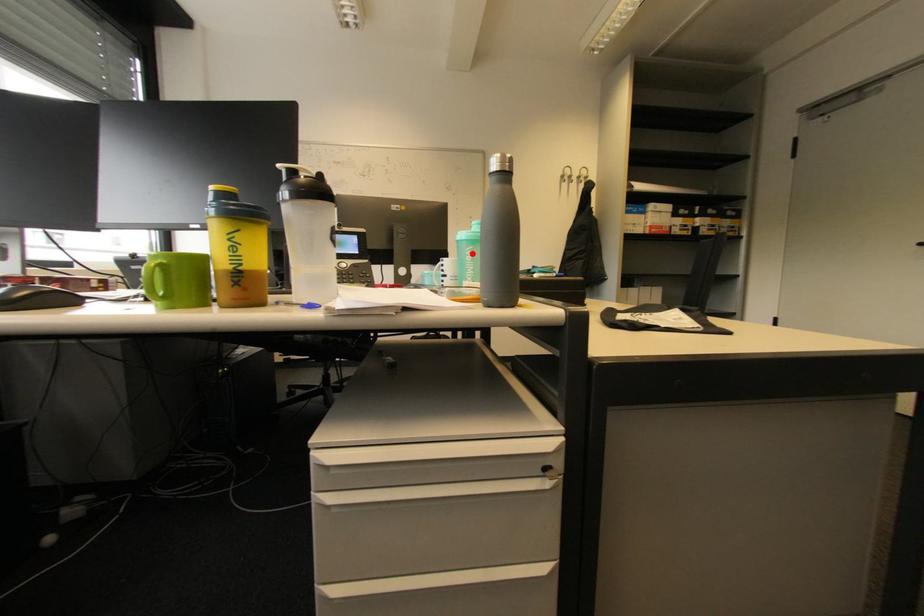
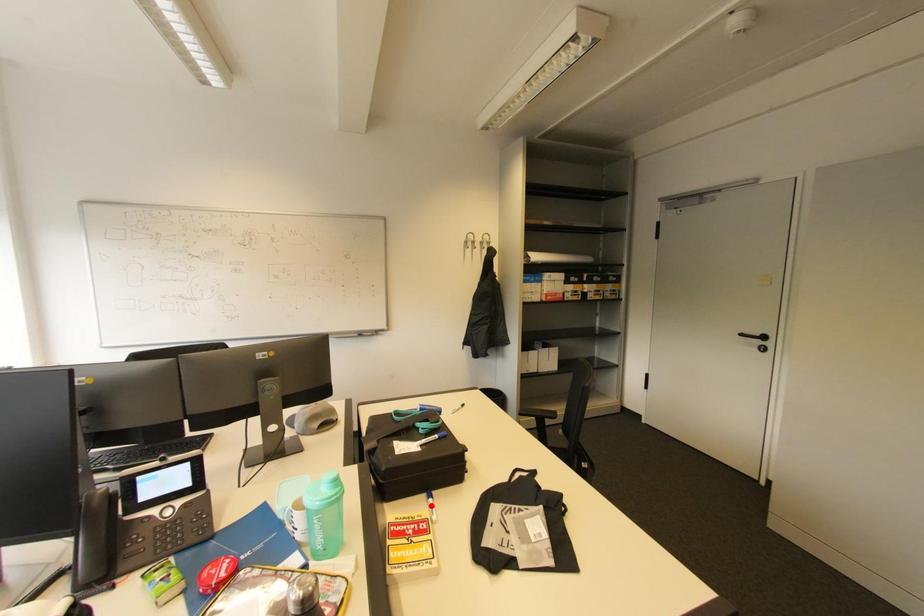
I am providing you with two images of the same scene from different viewpoints. A red point is marked on the first image and another point is marked on the second image. Is the marked point in image1 the same physical position as the marked point in image2?

No